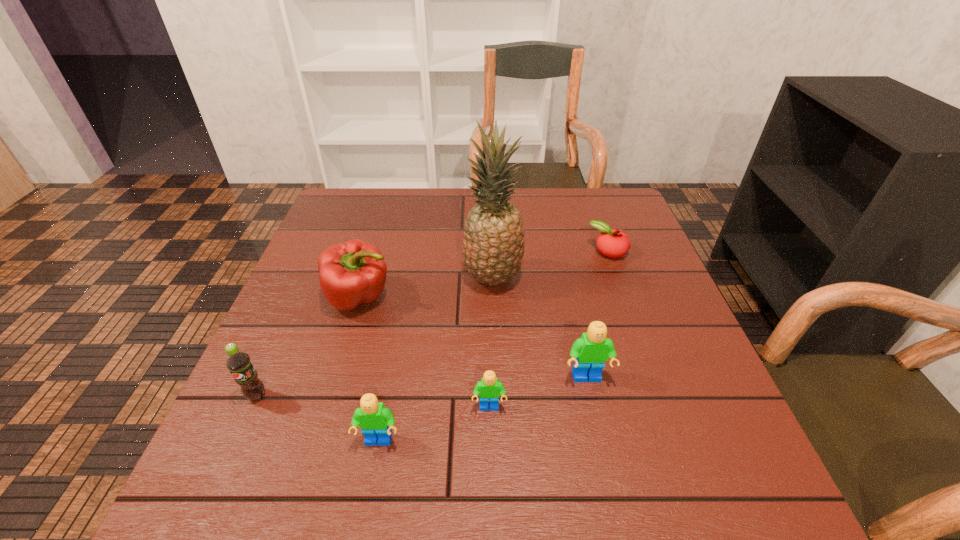
The height and width of the screenshot is (540, 960). Find the location of `object that is at the near left corner`. object that is at the near left corner is located at coordinates (238, 362).

You are a GUI agent. You are given a task and a screenshot of the screen. Output one action in this format:
    pyautogui.click(x=<x>, y=<y>)
    Task: Click on the free space at the far edge of the desktop
    This screenshot has height=540, width=960.
    Given the screenshot: What is the action you would take?
    pyautogui.click(x=444, y=205)

I want to click on vacant space at the near edge of the desktop, so click(x=561, y=411).

In the image, there is a desktop. Identify the location of free space at the left edge. This screenshot has width=960, height=540. (289, 364).

Identify the location of vacant space at the right edge of the desktop. (651, 364).

The image size is (960, 540). Identify the location of vacant space at the far left corner of the desktop. (370, 199).

Find the location of a particular element. The width and height of the screenshot is (960, 540). vacant space at the far right corner of the desktop is located at coordinates (580, 207).

I want to click on free space between the apple and the tallest object, so click(x=550, y=265).

This screenshot has width=960, height=540. Identify the location of free space between the tallest object and the soda. coord(375,337).

This screenshot has width=960, height=540. Find the location of `vacant region between the soda and the fifth tallest object`. vacant region between the soda and the fifth tallest object is located at coordinates (318, 418).